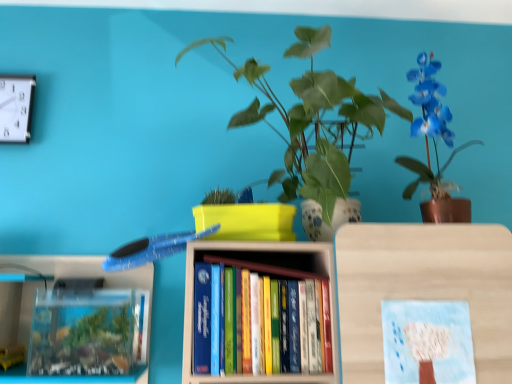
Question: Is green leafy plant at upper center bigger or smaller than blue glossy orchid at upper right?

Choices:
 (A) big
 (B) small

Answer: (A)

Question: Is point (100, 54) positioned closer to the camera than point (441, 132)?

Choices:
 (A) closer
 (B) farther

Answer: (B)

Question: Estimate the real-world distances between objects in this image. Which object is farther from the green leafy plant at upper center?

Choices:
 (A) hardcover books at center
 (B) blue glossy orchid at upper right
 (C) white plastic clock at upper left
 (D) pastel blue paper at center

Answer: (D)

Question: Which object is the farthest from the blue glossy orchid at upper right?

Choices:
 (A) green leafy plant at upper center
 (B) white plastic clock at upper left
 (C) pastel blue paper at center
 (D) hardcover books at center

Answer: (B)